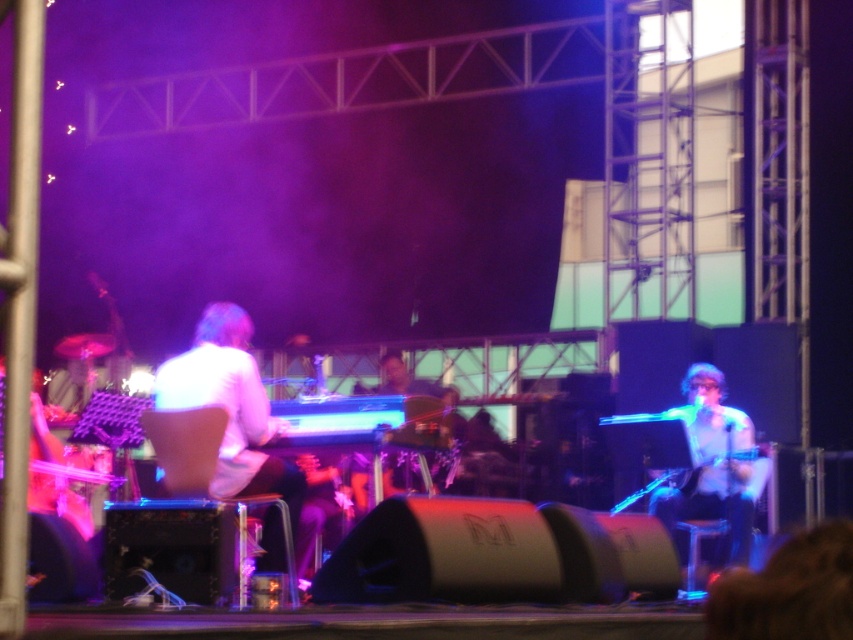
Is white matte keyboardist at center taller than white glossy microphone at center?

Indeed, white matte keyboardist at center has a greater height compared to white glossy microphone at center.

Which of these two, white matte keyboardist at center or white glossy microphone at center, stands taller?

white matte keyboardist at center is taller.

Is point (264, 531) positioned after point (766, 470)?

No, (264, 531) is in front of (766, 470).

Identify the location of white matte keyboardist at center. The height and width of the screenshot is (640, 853). (236, 413).